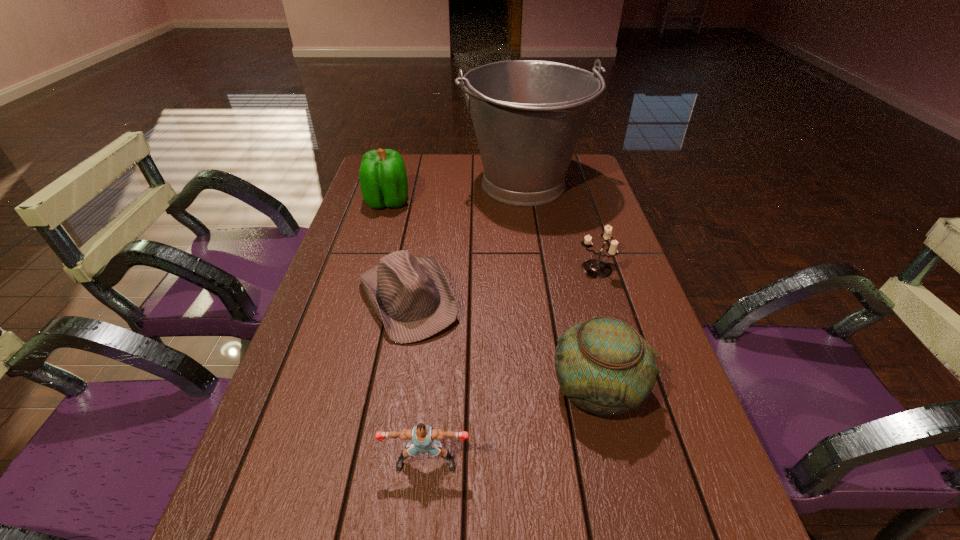
The image size is (960, 540). In order to click on the tallest object in this screenshot , I will do `click(528, 115)`.

In order to click on bell pepper in this screenshot , I will do `click(383, 179)`.

Where is `pottery`? Image resolution: width=960 pixels, height=540 pixels. pottery is located at coordinates (603, 365).

Identify the location of the second nearest object. (603, 365).

Identify the location of candle holder. Image resolution: width=960 pixels, height=540 pixels. (595, 268).

Locate an element on the screen. The image size is (960, 540). puncher is located at coordinates (422, 436).

Locate an element on the screen. fedora is located at coordinates (411, 296).

Image resolution: width=960 pixels, height=540 pixels. I want to click on vacant space located 0.150m on the front of the tallest object, so click(x=534, y=251).

At what (x,y) coordinates should I click in order to perform the action: click on vacant space located 0.160m on the back of the second tallest object. Please return your answer as a coordinate pair (x, y). Looking at the image, I should click on (397, 167).

At what (x,y) coordinates should I click in order to perform the action: click on free space located 0.400m on the left of the fourth shortest object. Please return your answer as a coordinate pair (x, y). The width and height of the screenshot is (960, 540). Looking at the image, I should click on (347, 389).